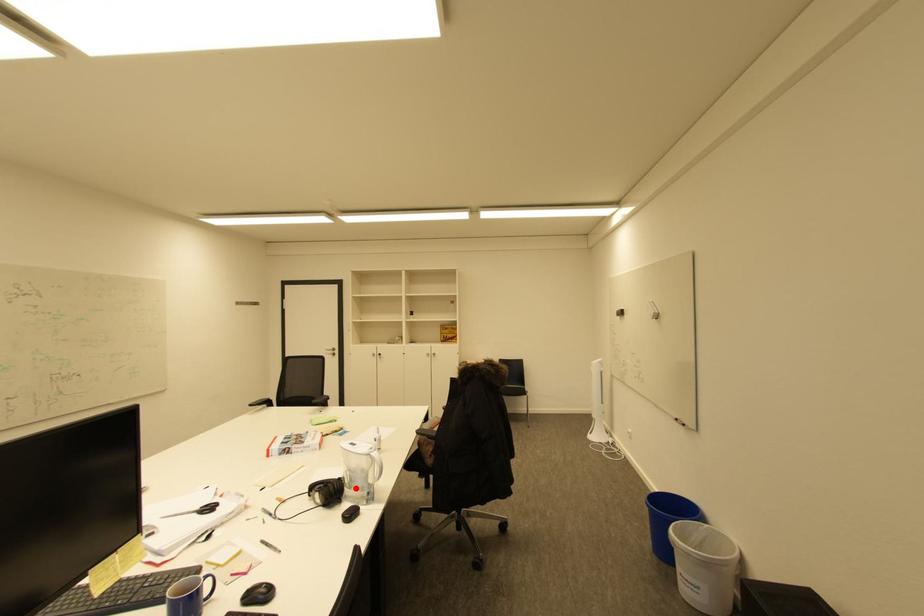
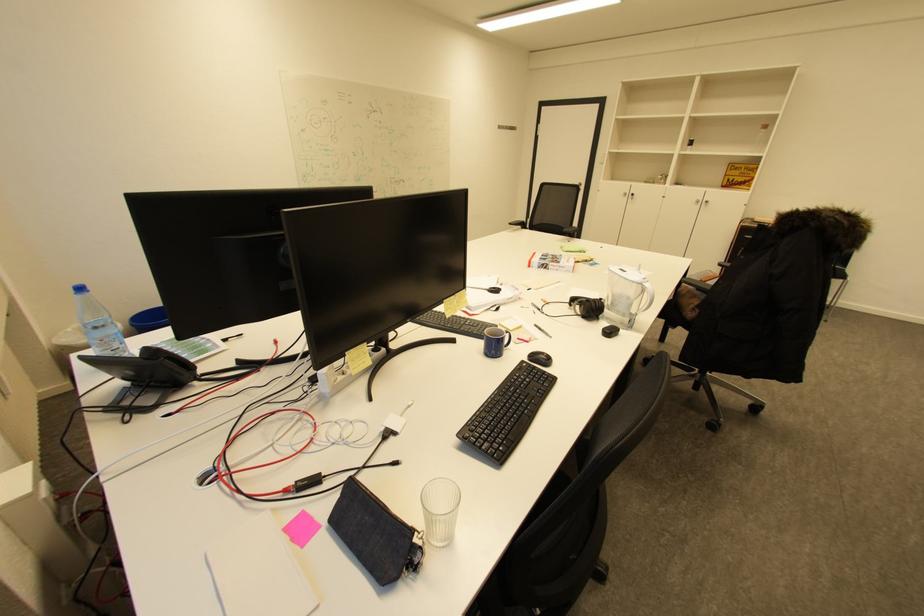
Locate, in the second image, the point that corresponds to the highlighted location in the first image.

(614, 310)